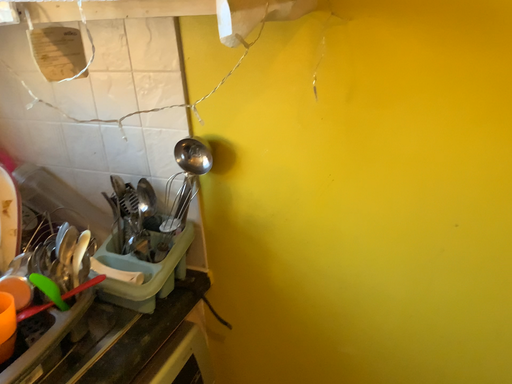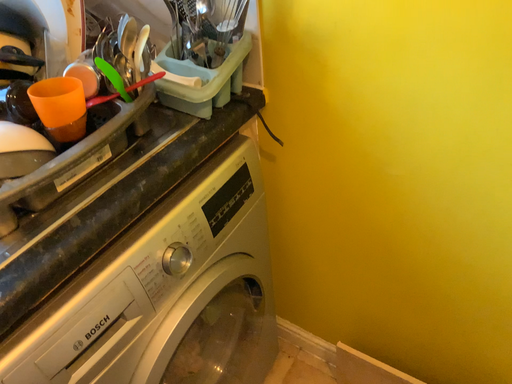
Question: How did the camera likely rotate when shooting the video?

Choices:
 (A) rotated downward
 (B) rotated upward

Answer: (A)